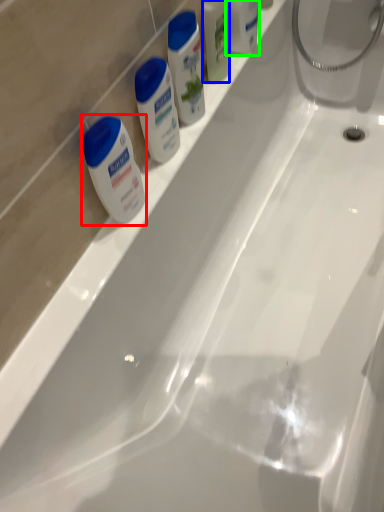
Question: Considering the real-world distances, which object is closest to shaving cream (highlighted by a red box)? mouthwash (highlighted by a blue box) or toiletry (highlighted by a green box).

Choices:
 (A) mouthwash
 (B) toiletry

Answer: (A)